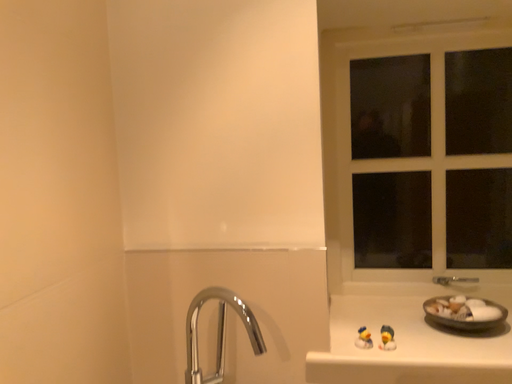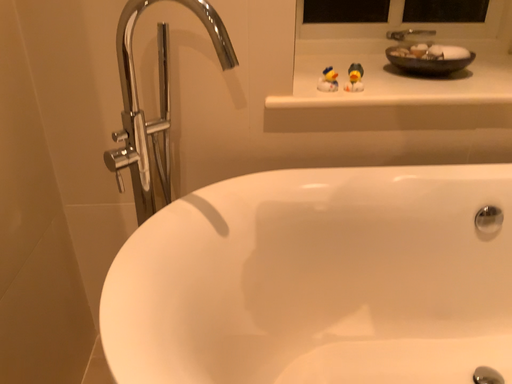
Question: How did the camera likely rotate when shooting the video?

Choices:
 (A) rotated downward
 (B) rotated upward

Answer: (A)